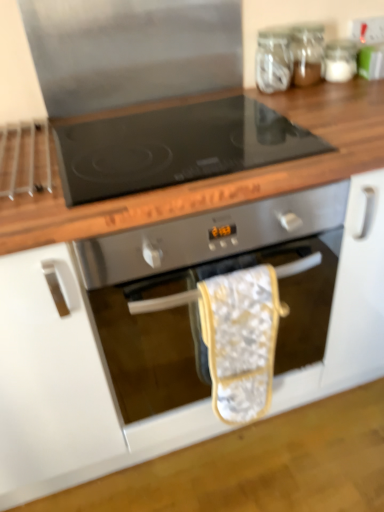
Question: Is transparent glass jar at upper right, placed as the 2th glass jar when sorted from left to right, bigger than white fabric oven mitt at center?

Choices:
 (A) no
 (B) yes

Answer: (A)

Question: Could you tell me if transparent glass jar at upper right, placed as the 2th glass jar when sorted from left to right, is turned towards white fabric oven mitt at center?

Choices:
 (A) no
 (B) yes

Answer: (A)

Question: From a real-world perspective, is transparent glass jar at upper right, placed as the 2th glass jar when sorted from left to right, positioned under white fabric oven mitt at center based on gravity?

Choices:
 (A) yes
 (B) no

Answer: (B)

Question: Is transparent glass jar at upper right, which appears as the second glass jar when viewed from the right, smaller than white fabric oven mitt at center?

Choices:
 (A) no
 (B) yes

Answer: (B)

Question: Considering the relative positions of transparent glass jar at upper right, placed as the 2th glass jar when sorted from left to right, and white fabric oven mitt at center in the image provided, is transparent glass jar at upper right, placed as the 2th glass jar when sorted from left to right, to the right of white fabric oven mitt at center from the viewer's perspective?

Choices:
 (A) no
 (B) yes

Answer: (B)

Question: From the image's perspective, would you say transparent glass jar at upper right, which appears as the second glass jar when viewed from the right, is positioned over white fabric oven mitt at center?

Choices:
 (A) no
 (B) yes

Answer: (B)

Question: From a real-world perspective, is stainless steel oven at center located beneath transparent glass jar at upper right, marked as the 1th glass jar in a right-to-left arrangement?

Choices:
 (A) yes
 (B) no

Answer: (A)

Question: Can you confirm if stainless steel oven at center is shorter than transparent glass jar at upper right, marked as the 1th glass jar in a right-to-left arrangement?

Choices:
 (A) no
 (B) yes

Answer: (A)

Question: Is stainless steel oven at center at the right side of transparent glass jar at upper right, marked as the 1th glass jar in a right-to-left arrangement?

Choices:
 (A) no
 (B) yes

Answer: (A)

Question: Is transparent glass jar at upper right, the third glass jar in the left-to-right sequence, at the back of stainless steel oven at center?

Choices:
 (A) no
 (B) yes

Answer: (A)

Question: Is stainless steel oven at center taller than transparent glass jar at upper right, the third glass jar in the left-to-right sequence?

Choices:
 (A) no
 (B) yes

Answer: (B)

Question: From the image's perspective, is stainless steel oven at center above transparent glass jar at upper right, marked as the 1th glass jar in a right-to-left arrangement?

Choices:
 (A) yes
 (B) no

Answer: (B)

Question: Can you confirm if transparent glass jar at upper right, the third glass jar in the left-to-right sequence, is wider than stainless steel oven at center?

Choices:
 (A) no
 (B) yes

Answer: (A)